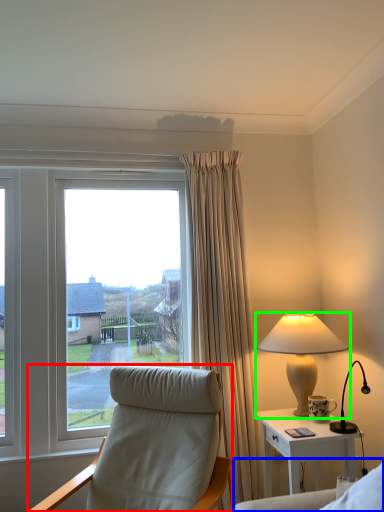
Question: Considering the real-world distances, which object is closest to chair (highlighted by a red box)? couch (highlighted by a blue box) or lamp (highlighted by a green box).

Choices:
 (A) couch
 (B) lamp

Answer: (A)